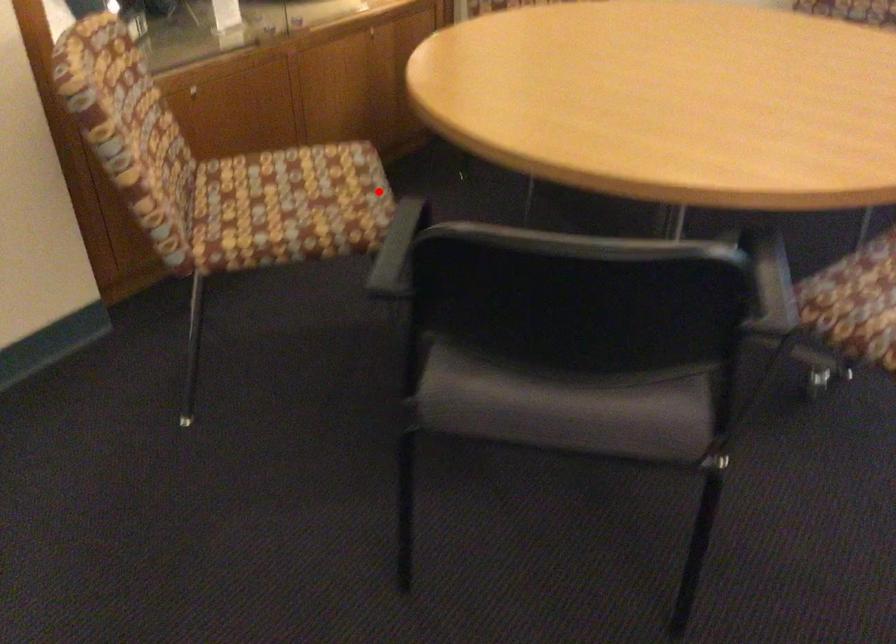
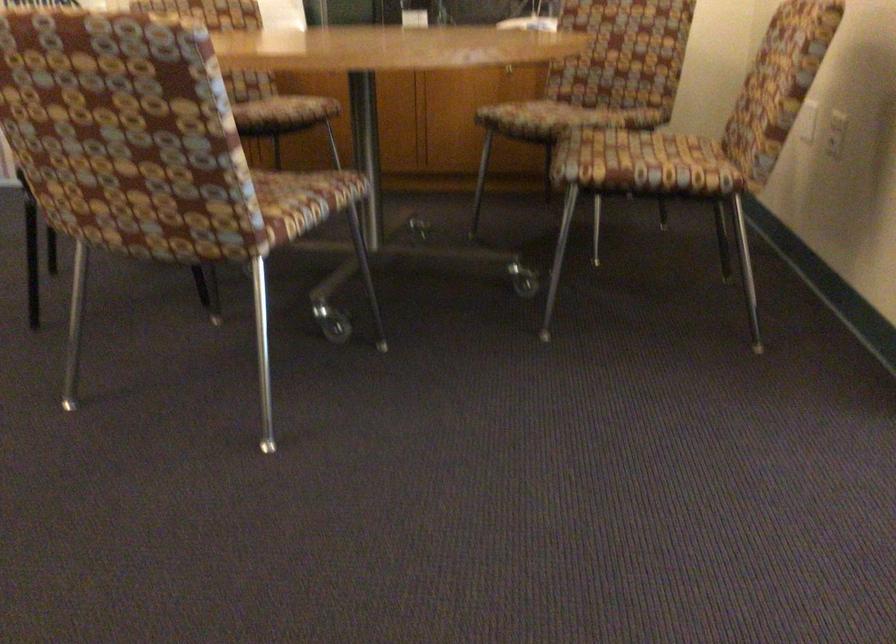
Where in the second image is the point corresponding to the highlighted location from the first image?

(279, 111)